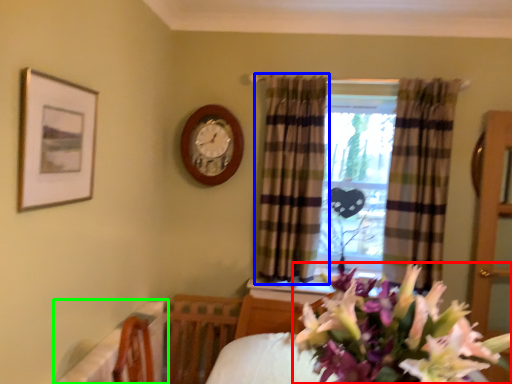
Question: Based on their relative distances, which object is nearer to flower (highlighted by a red box)? Choose from curtain (highlighted by a blue box) and table (highlighted by a green box).

Choices:
 (A) curtain
 (B) table

Answer: (B)